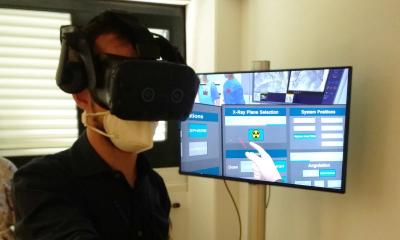
Locate an element on the screen. The image size is (400, 240). window frame is located at coordinates (150, 17).